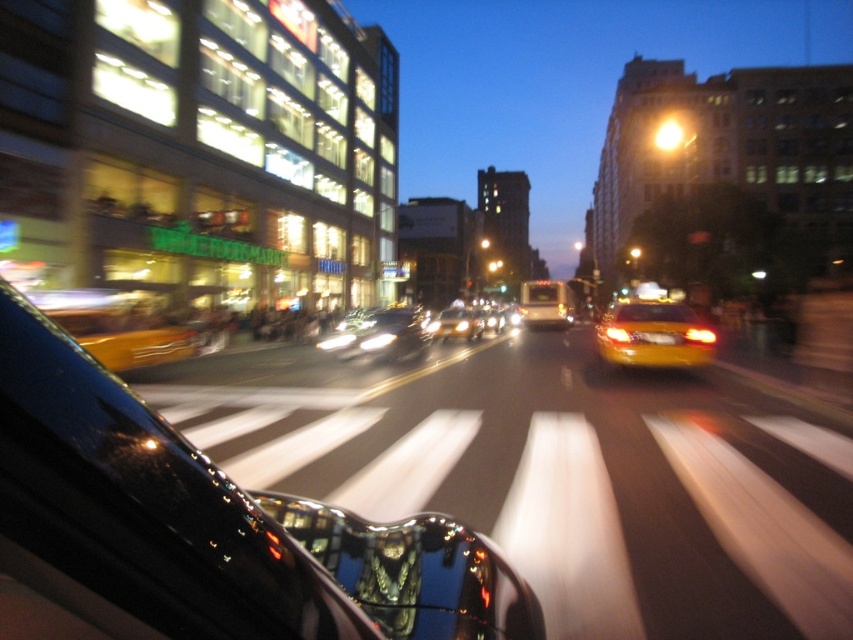
Which is in front, point (178, 461) or point (386, 326)?

Point (178, 461)

Is glossy black car at center to the right of shiny silver car at center from the viewer's perspective?

Indeed, glossy black car at center is positioned on the right side of shiny silver car at center.

Identify the location of glossy black car at center. (212, 524).

This screenshot has height=640, width=853. Identify the location of glossy black car at center. (212, 524).

Between point (73, 305) and point (660, 342), which one is positioned behind?

Point (660, 342)

Does yellow matte taxi at left have a smaller size compared to yellow matte taxi at center-right?

Incorrect, yellow matte taxi at left is not smaller in size than yellow matte taxi at center-right.

Is point (160, 323) farther from viewer compared to point (674, 364)?

That is True.

Find the location of a particular element. The image size is (853, 640). yellow matte taxi at left is located at coordinates (117, 326).

Who is taller, yellow matte taxi at left or shiny silver sedan at center?

Standing taller between the two is yellow matte taxi at left.

Between yellow matte taxi at left and shiny silver sedan at center, which one appears on the left side from the viewer's perspective?

From the viewer's perspective, yellow matte taxi at left appears more on the left side.

Is point (137, 356) closer to camera compared to point (434, 333)?

That is True.

Identify the location of yellow matte taxi at left. Image resolution: width=853 pixels, height=640 pixels. (117, 326).